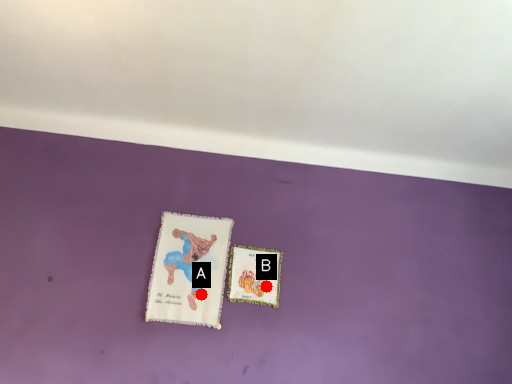
Question: Two points are circled on the image, labeled by A and B beside each circle. Which point is farther to the camera?

Choices:
 (A) A is further
 (B) B is further

Answer: (B)